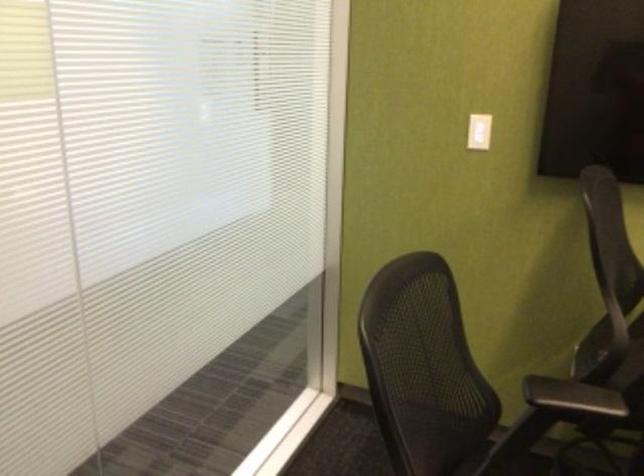
What do you see at coordinates (478, 131) in the screenshot?
I see `the white light switch` at bounding box center [478, 131].